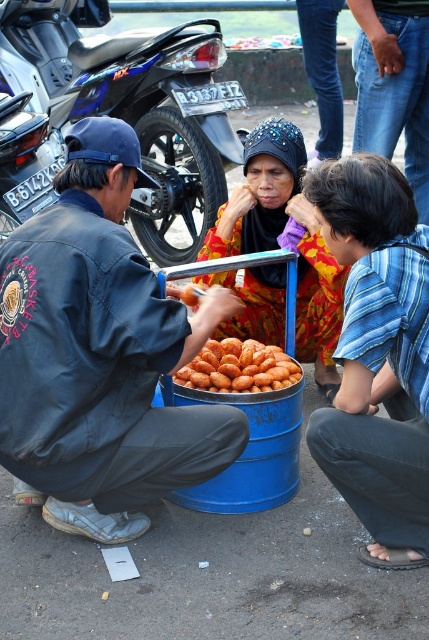
Is point (187, 209) behind point (401, 10)?

Yes, point (187, 209) is behind point (401, 10).

Is black glossy motorcycle at upper left positioned at the back of jeans at center?

Yes.

Is point (205, 42) positioned before point (399, 60)?

No, (205, 42) is further to viewer.

Identify the location of black glossy motorcycle at upper left. (162, 122).

Which is behind, point (238, 332) or point (223, 369)?

Point (238, 332)

Is floral fabric headscarf at center thinner than golden fried snack at center?

In fact, floral fabric headscarf at center might be wider than golden fried snack at center.

Locate an element on the screen. floral fabric headscarf at center is located at coordinates (280, 234).

Between point (356, 272) and point (247, 339), which one is positioned behind?

The point (247, 339) is more distant.

Locate an element on the screen. The width and height of the screenshot is (429, 640). blue striped shirt at lower right is located at coordinates (377, 355).